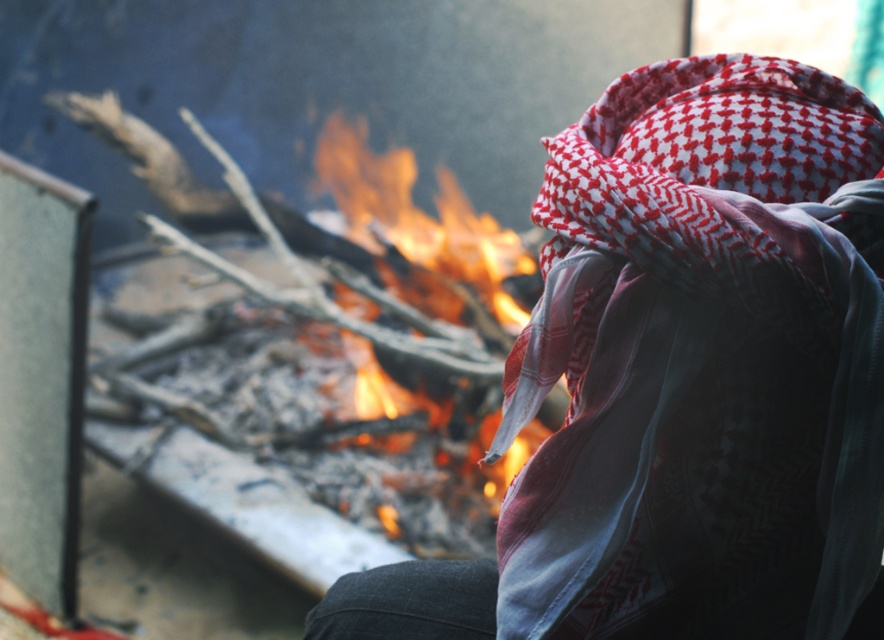
Question: Which point appears closest to the camera in this image?

Choices:
 (A) (570, 212)
 (B) (379, 225)

Answer: (A)

Question: Is red-white checkered scarf at right to the right of flaming wood at center from the viewer's perspective?

Choices:
 (A) no
 (B) yes

Answer: (B)

Question: Is red-white checkered scarf at right further to the viewer compared to flaming wood at center?

Choices:
 (A) yes
 (B) no

Answer: (B)

Question: Does red-white checkered scarf at right appear over flaming wood at center?

Choices:
 (A) yes
 (B) no

Answer: (B)